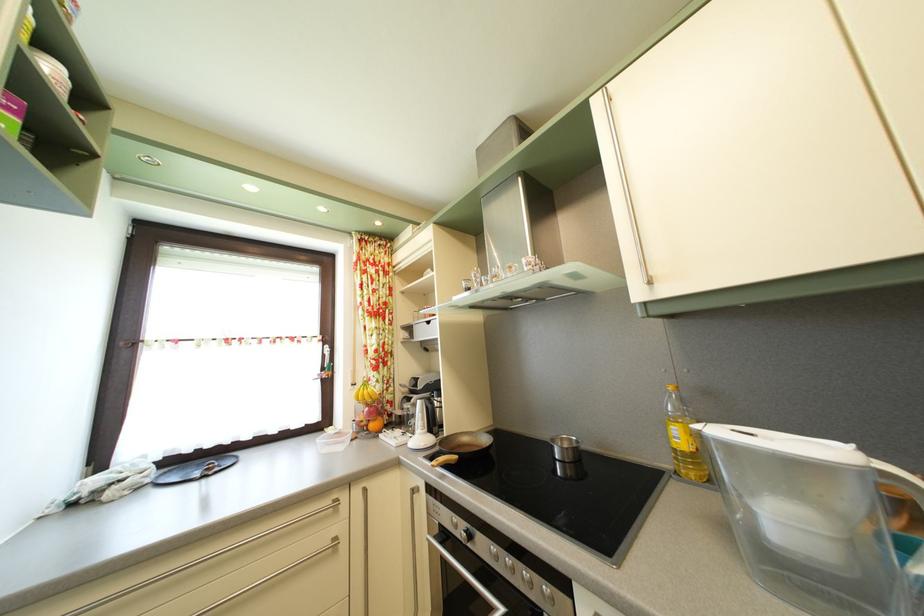
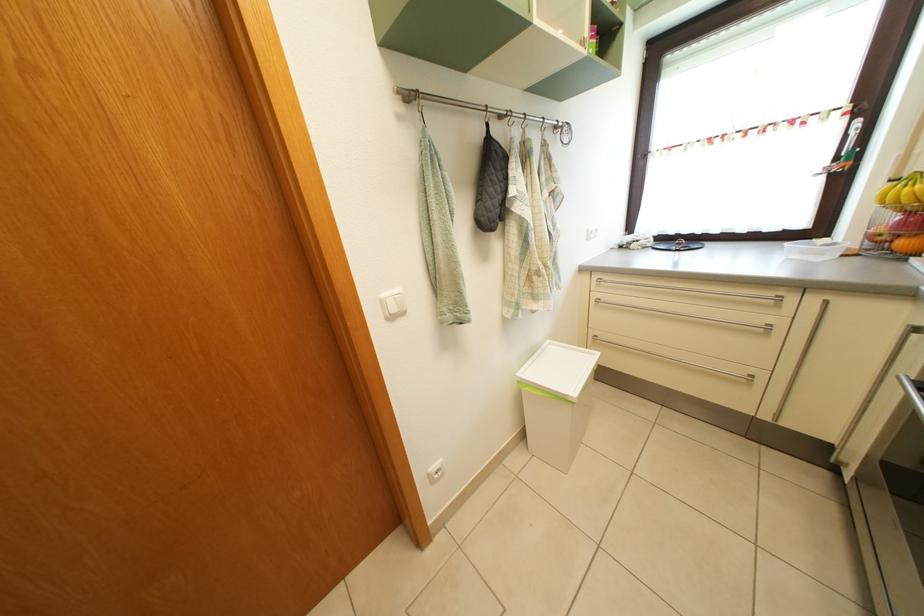
Find the pixel in the second image that matches the point at 381,432 in the first image.

(910, 252)